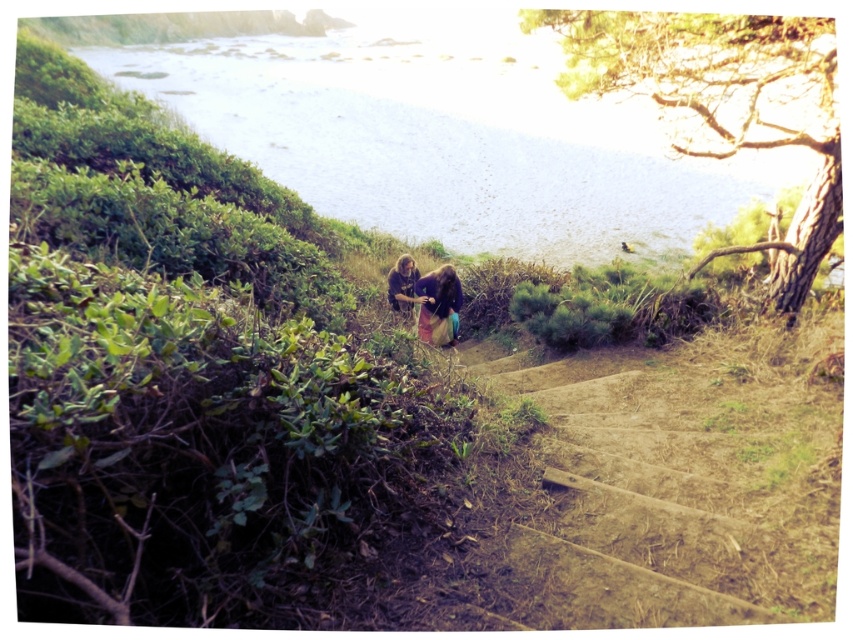
Which is more to the left, dark brown hair at center or matte brown pants at center?

From the viewer's perspective, matte brown pants at center appears more on the left side.

Which is above, dark brown hair at center or matte brown pants at center?

matte brown pants at center

Is point (424, 296) closer to camera compared to point (398, 280)?

Yes, point (424, 296) is in front of point (398, 280).

The width and height of the screenshot is (853, 640). I want to click on dark brown hair at center, so click(438, 307).

Can you confirm if brown dirt stairs at center is positioned below matte brown pants at center?

Correct, brown dirt stairs at center is located below matte brown pants at center.

Locate an element on the screen. Image resolution: width=853 pixels, height=640 pixels. brown dirt stairs at center is located at coordinates click(x=630, y=504).

Does brown dirt stairs at center come behind dark brown hair at center?

No.

Can you confirm if brown dirt stairs at center is shorter than dark brown hair at center?

Correct, brown dirt stairs at center is not as tall as dark brown hair at center.

Which is behind, point (669, 532) or point (434, 305)?

The point (434, 305) is behind.

Identify the location of brown dirt stairs at center. The width and height of the screenshot is (853, 640). (630, 504).